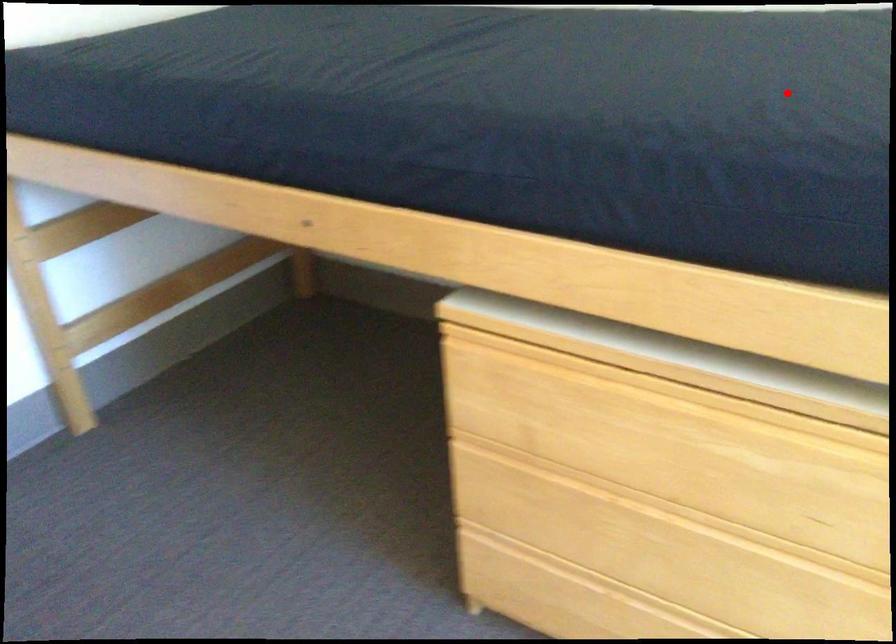
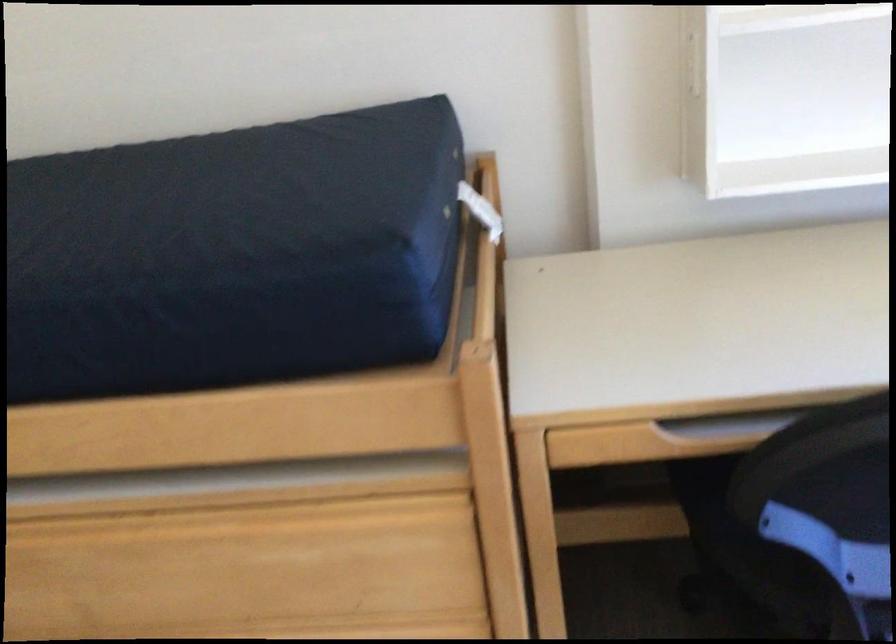
Question: I am providing you with two images of the same scene from different viewpoints. A red point is marked on the first image. Is the red point's position out of view in image 2?

Choices:
 (A) Yes
 (B) No

Answer: (B)